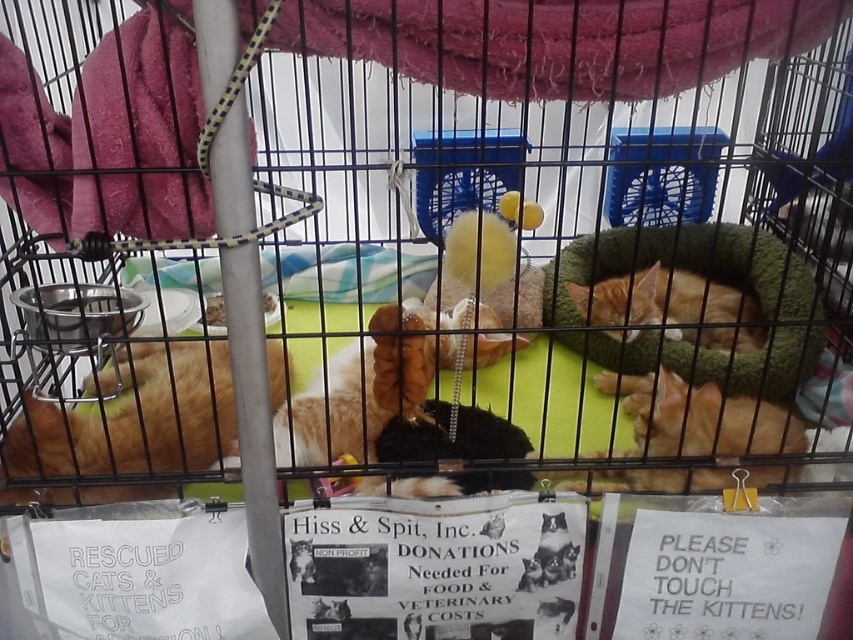
You are a caretaker checking the cage for the kittens. You notice the orange fur cat at left and the yellow plush toy at center. Which object is wider in the cage?

The orange fur cat at left is wider than the yellow plush toy at center.

You are a volunteer at an animal shelter and need to separate two kittens. You see an orange fur cat at left and an orange fur cat at center. Which one should you approach first to ensure you can reach them without disturbing the other?

You should approach the orange fur cat at left first because it is positioned to the left of the orange fur cat at center, so reaching it first would avoid disturbing the other kitten.